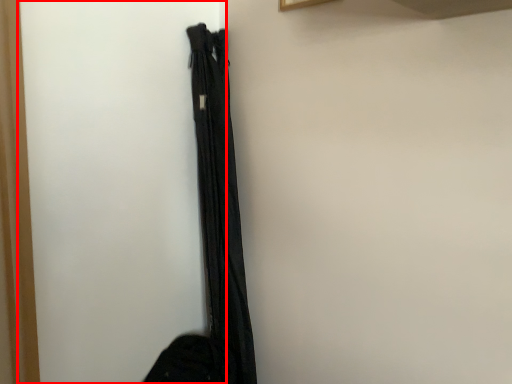
Question: Considering the relative positions of screen door (annotated by the red box) and curtain in the image provided, where is screen door (annotated by the red box) located with respect to the staircase?

Choices:
 (A) left
 (B) right

Answer: (A)